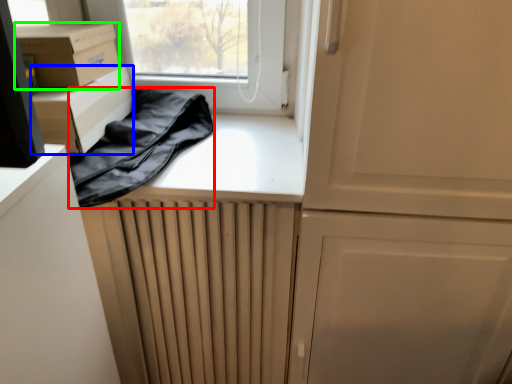
Question: Which is farther away from clothing (highlighted by a red box)? cardboard box (highlighted by a blue box) or cardboard box (highlighted by a green box)?

Choices:
 (A) cardboard box
 (B) cardboard box

Answer: (B)